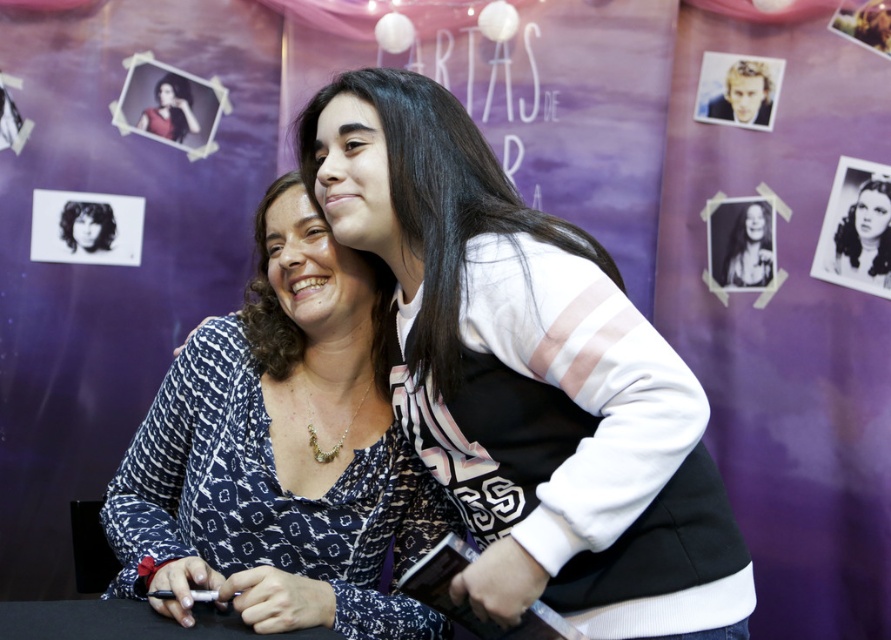
Question: Is white matte sweater at center thinner than patterned fabric blouse at center?

Choices:
 (A) no
 (B) yes

Answer: (A)

Question: Which point appears farthest from the camera in this image?

Choices:
 (A) (311, 340)
 (B) (884, 250)

Answer: (B)

Question: Is white matte sweater at center smaller than patterned fabric blouse at center?

Choices:
 (A) no
 (B) yes

Answer: (B)

Question: Among these points, which one is nearest to the camera?

Choices:
 (A) (503, 536)
 (B) (267, 369)

Answer: (A)

Question: Where is patterned fabric blouse at center located in relation to black glossy photo at upper right in the image?

Choices:
 (A) below
 (B) above

Answer: (A)

Question: Among these objects, which one is nearest to the camera?

Choices:
 (A) black glossy photo at upper right
 (B) black glossy photo at center
 (C) patterned fabric blouse at center
 (D) white matte sweater at center

Answer: (D)